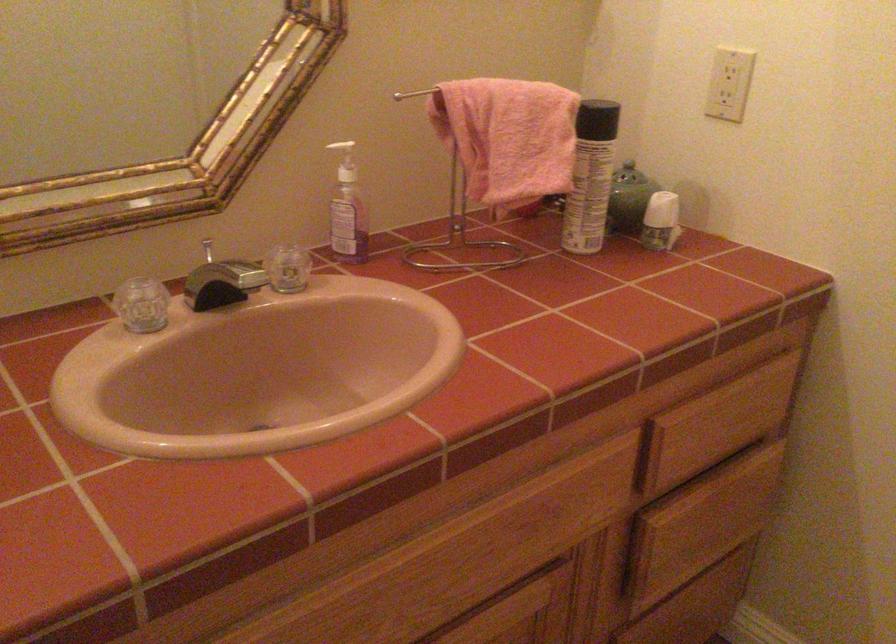
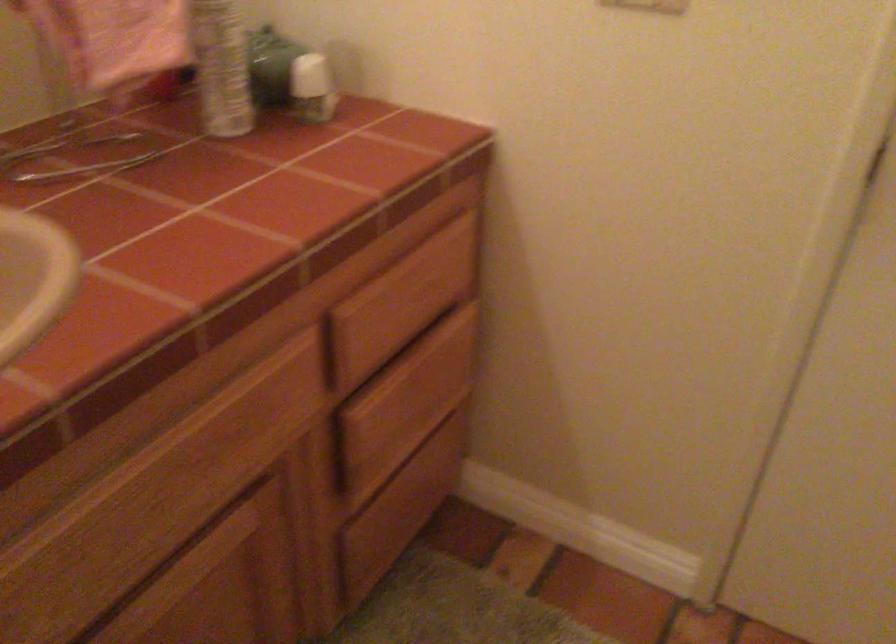
Question: Based on the continuous images, in which direction is the camera rotating? Reply with the corresponding letter.

Choices:
 (A) Left
 (B) Right
 (C) Up
 (D) Down

Answer: (B)